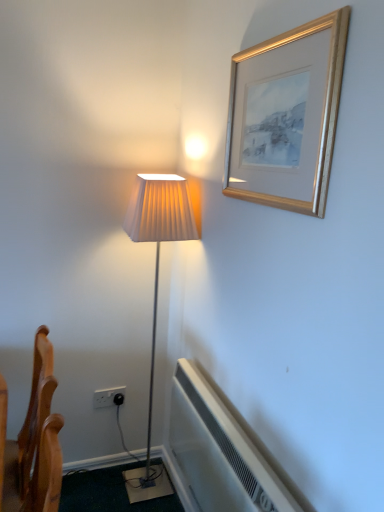
Question: Would you say white plastic air conditioner at lower center is part of white plastic electric outlet at lower left's contents?

Choices:
 (A) yes
 (B) no

Answer: (B)

Question: Can you confirm if white plastic electric outlet at lower left is shorter than white plastic air conditioner at lower center?

Choices:
 (A) yes
 (B) no

Answer: (A)

Question: Is white plastic air conditioner at lower center at the back of white plastic electric outlet at lower left?

Choices:
 (A) yes
 (B) no

Answer: (B)

Question: Is white plastic electric outlet at lower left at the left side of white plastic air conditioner at lower center?

Choices:
 (A) yes
 (B) no

Answer: (A)

Question: From the image's perspective, is white plastic electric outlet at lower left located above white plastic air conditioner at lower center?

Choices:
 (A) yes
 (B) no

Answer: (A)

Question: Is wooden chair at lower left in front of or behind white plastic air conditioner at lower center in the image?

Choices:
 (A) behind
 (B) front

Answer: (A)

Question: Do you think wooden chair at lower left is within white plastic air conditioner at lower center, or outside of it?

Choices:
 (A) inside
 (B) outside

Answer: (B)

Question: Is point (26, 459) closer or farther from the camera than point (261, 497)?

Choices:
 (A) farther
 (B) closer

Answer: (A)

Question: In the image, is wooden chair at lower left on the left side or the right side of white plastic air conditioner at lower center?

Choices:
 (A) right
 (B) left

Answer: (B)

Question: Choose the correct answer: Is gold metallic picture frame at upper right inside white plastic air conditioner at lower center or outside it?

Choices:
 (A) outside
 (B) inside

Answer: (A)

Question: Based on their positions, is gold metallic picture frame at upper right located to the left or right of white plastic air conditioner at lower center?

Choices:
 (A) left
 (B) right

Answer: (B)

Question: Is gold metallic picture frame at upper right bigger or smaller than white plastic air conditioner at lower center?

Choices:
 (A) big
 (B) small

Answer: (B)

Question: From a real-world perspective, is gold metallic picture frame at upper right above or below white plastic air conditioner at lower center?

Choices:
 (A) below
 (B) above

Answer: (B)

Question: Relative to gold metallic picture frame at upper right, is white plastic electric outlet at lower left in front or behind?

Choices:
 (A) front
 (B) behind

Answer: (B)

Question: Looking at the image, does white plastic electric outlet at lower left seem bigger or smaller compared to gold metallic picture frame at upper right?

Choices:
 (A) small
 (B) big

Answer: (A)